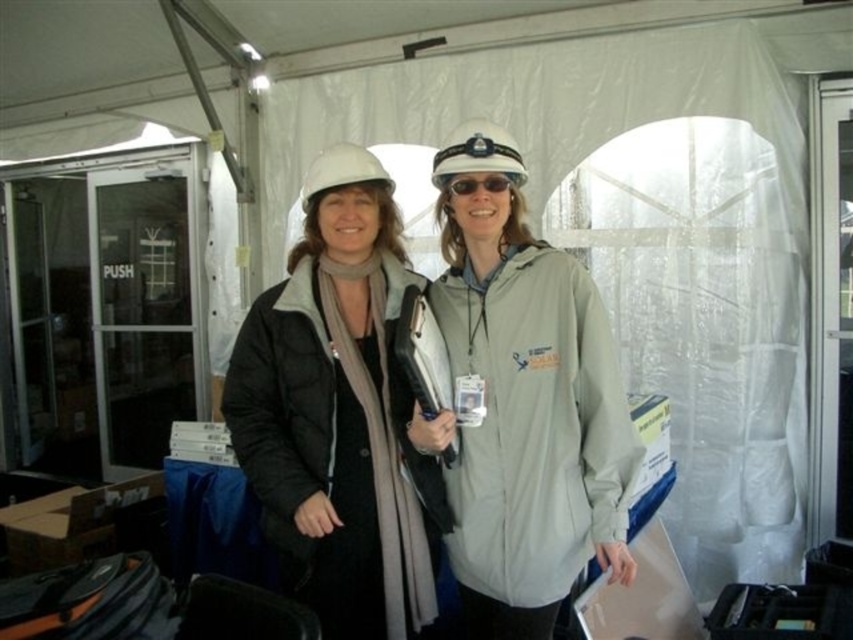
Is white matte hard hat at center further to camera compared to matte white hard hat at center?

No, it is in front of matte white hard hat at center.

Can you confirm if white matte hard hat at center is taller than matte white hard hat at center?

Incorrect, white matte hard hat at center's height is not larger of matte white hard hat at center's.

You are a GUI agent. You are given a task and a screenshot of the screen. Output one action in this format:
    pyautogui.click(x=<x>, y=<y>)
    Task: Click on the white matte hard hat at center
    Image resolution: width=853 pixels, height=640 pixels.
    Given the screenshot: What is the action you would take?
    pyautogui.click(x=477, y=154)

Between white matte hard hat at center and sunglassestransparent at center, which one is positioned lower?

sunglassestransparent at center is below.

Is white matte hard hat at center to the left of sunglassestransparent at center from the viewer's perspective?

Incorrect, white matte hard hat at center is not on the left side of sunglassestransparent at center.

Based on the photo, who is more forward, (x=508, y=163) or (x=492, y=188)?

Point (x=508, y=163) is in front.

Find the location of a particular element. The width and height of the screenshot is (853, 640). white matte hard hat at center is located at coordinates (477, 154).

Is matte black jacket at center bigger than matte white hard hat at center?

Correct, matte black jacket at center is larger in size than matte white hard hat at center.

Does point (302, 524) come closer to viewer compared to point (314, 184)?

Yes, point (302, 524) is in front of point (314, 184).

Where is `matte black jacket at center`? The height and width of the screenshot is (640, 853). matte black jacket at center is located at coordinates (341, 422).